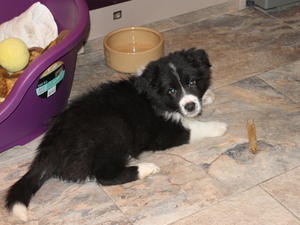
This screenshot has height=225, width=300. I want to click on water bowl, so click(x=136, y=48).